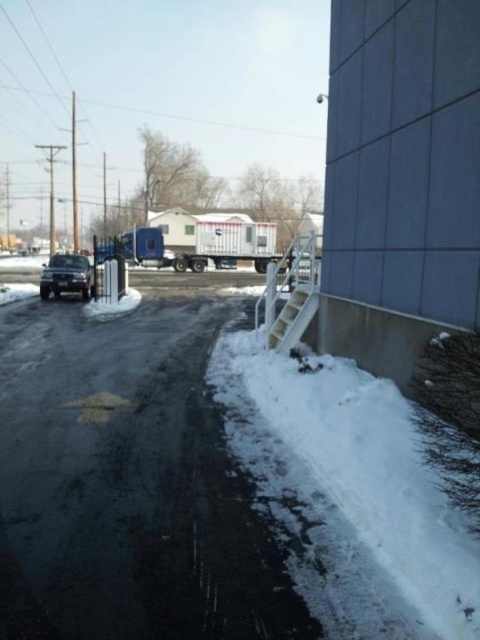
Question: Estimate the real-world distances between objects in this image. Which object is closer to the shiny black sedan at left?

Choices:
 (A) white fluffy snow at lower right
 (B) white plastic trailer truck at center

Answer: (B)

Question: Among these points, which one is nearest to the camera?

Choices:
 (A) (297, 474)
 (B) (242, 216)
 (C) (46, 264)

Answer: (A)

Question: Observing the image, what is the correct spatial positioning of white fluffy snow at lower right in reference to shiny black sedan at left?

Choices:
 (A) above
 (B) below

Answer: (B)

Question: Does white plastic trailer truck at center come in front of shiny black sedan at left?

Choices:
 (A) no
 (B) yes

Answer: (A)

Question: Among these points, which one is nearest to the camera?

Choices:
 (A) (75, 268)
 (B) (280, 516)

Answer: (B)

Question: From the image, what is the correct spatial relationship of white fluffy snow at lower right in relation to white plastic trailer truck at center?

Choices:
 (A) right
 (B) left

Answer: (B)